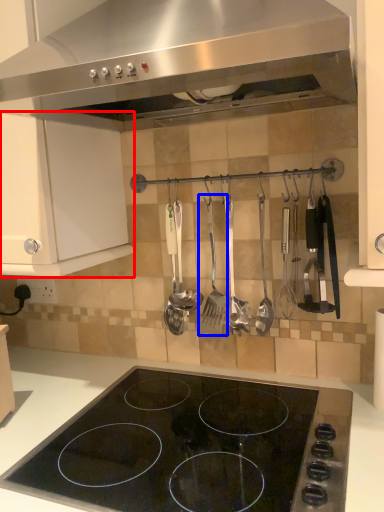
Question: Which object appears farthest to the camera in this image, cabinetry (highlighted by a red box) or silverware (highlighted by a blue box)?

Choices:
 (A) cabinetry
 (B) silverware

Answer: (B)